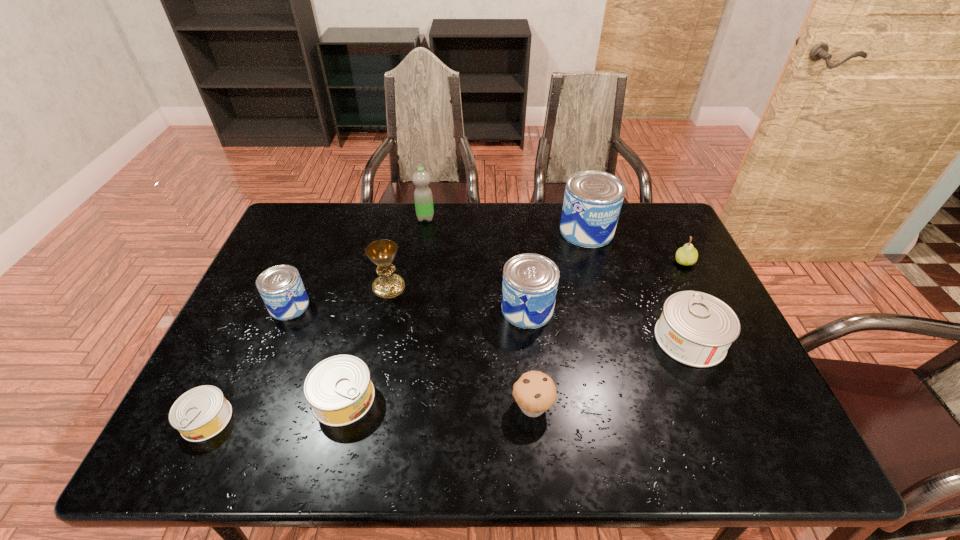
Locate an element on the screen. Image resolution: width=960 pixels, height=540 pixels. can that is the fifth nearest to the second silver can from left to right is located at coordinates (696, 329).

The height and width of the screenshot is (540, 960). I want to click on the second closest blue can to the chalice, so click(x=530, y=281).

Identify the location of the closest blue can to the smallest silver can. The height and width of the screenshot is (540, 960). (281, 288).

Select which silver can is the second closest to the chalice. Please provide its 2D coordinates. Your answer should be formatted as a tuple, i.e. [(x, y)], where the tuple contains the x and y coordinates of a point satisfying the conditions above.

[(201, 413)]

This screenshot has height=540, width=960. Find the location of `silver can that is the third closest to the third farthest object`. silver can that is the third closest to the third farthest object is located at coordinates (201, 413).

The width and height of the screenshot is (960, 540). Identify the location of free space that satisfies the following two spatial constraints: 1. on the back side of the rightmost silver can; 2. on the left side of the muffin. (526, 339).

This screenshot has height=540, width=960. In order to click on vacant space that satisfies the following two spatial constraints: 1. on the back side of the muffin; 2. on the front label of the leftmost blue can in this screenshot , I will do point(522,306).

At what (x,y) coordinates should I click in order to perform the action: click on free location that satisfies the following two spatial constraints: 1. on the back side of the green pear; 2. on the right side of the rightmost silver can. Please return your answer as a coordinate pair (x, y). The image size is (960, 540). Looking at the image, I should click on (657, 262).

You are a GUI agent. You are given a task and a screenshot of the screen. Output one action in this format:
    pyautogui.click(x=<x>, y=<y>)
    Task: Click on the free location that satisfies the following two spatial constraints: 1. on the front label of the farthest blue can; 2. on the front label of the second biggest blue can
    
    Given the screenshot: What is the action you would take?
    pyautogui.click(x=609, y=309)